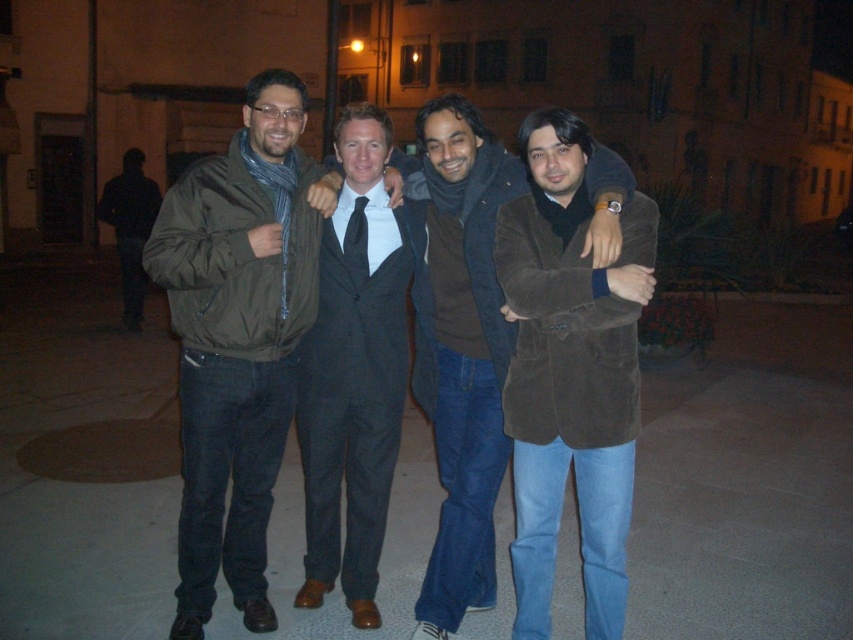
Measure the distance between matte olive green jacket at center and suede coat at center.

matte olive green jacket at center and suede coat at center are 1.08 meters apart.

Is point (173, 316) farther from viewer compared to point (538, 588)?

Yes, it is behind point (538, 588).

Image resolution: width=853 pixels, height=640 pixels. In order to click on matte olive green jacket at center in this screenshot , I will do `click(238, 337)`.

In the scene shown: Is suede coat at center closer to the viewer compared to dark brown suit at center?

Yes, suede coat at center is in front of dark brown suit at center.

Is point (550, 545) positioned behind point (444, 132)?

No, (550, 545) is in front of (444, 132).

Image resolution: width=853 pixels, height=640 pixels. I want to click on suede coat at center, so click(570, 376).

Is matte olive green jacket at center below dark brown suit at center?

Actually, matte olive green jacket at center is above dark brown suit at center.

Looking at this image, measure the distance from matte olive green jacket at center to dark brown suit at center.

matte olive green jacket at center is 25.10 inches from dark brown suit at center.

Is point (277, 326) in front of point (483, 304)?

Yes, point (277, 326) is closer to viewer.

I want to click on matte olive green jacket at center, so click(x=238, y=337).